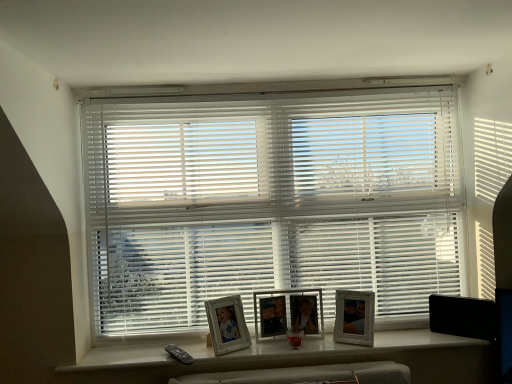
Question: Is white glossy picture frame at center, marked as the third picture frame in a left-to-right arrangement, smaller than white plastic frames at center?

Choices:
 (A) no
 (B) yes

Answer: (B)

Question: Considering the relative sizes of white glossy picture frame at center, arranged as the 1th picture frame when viewed from the right, and white plastic frames at center in the image provided, is white glossy picture frame at center, arranged as the 1th picture frame when viewed from the right, shorter than white plastic frames at center?

Choices:
 (A) yes
 (B) no

Answer: (B)

Question: From a real-world perspective, does white glossy picture frame at center, marked as the third picture frame in a left-to-right arrangement, stand above white plastic frames at center?

Choices:
 (A) yes
 (B) no

Answer: (A)

Question: Is white glossy picture frame at center, arranged as the 1th picture frame when viewed from the right, facing towards white plastic frames at center?

Choices:
 (A) yes
 (B) no

Answer: (B)

Question: Can you confirm if white glossy picture frame at center, arranged as the 1th picture frame when viewed from the right, is positioned to the right of white plastic frames at center?

Choices:
 (A) no
 (B) yes

Answer: (B)

Question: In terms of width, does wooden photo frame at center, arranged as the second picture frame when viewed from the left, look wider or thinner when compared to white plastic blinds at center?

Choices:
 (A) wide
 (B) thin

Answer: (B)

Question: Looking at the image, does wooden photo frame at center, placed as the second picture frame when sorted from right to left, seem bigger or smaller compared to white plastic blinds at center?

Choices:
 (A) big
 (B) small

Answer: (B)

Question: Is point (317, 337) closer or farther from the camera than point (256, 150)?

Choices:
 (A) closer
 (B) farther

Answer: (A)

Question: From the image's perspective, is wooden photo frame at center, placed as the second picture frame when sorted from right to left, located above or below white plastic blinds at center?

Choices:
 (A) below
 (B) above

Answer: (A)

Question: Considering their positions, is white wooden picture frame at center, which is the first picture frame in left-to-right order, located in front of or behind white glossy picture frame at center, arranged as the 1th picture frame when viewed from the right?

Choices:
 (A) front
 (B) behind

Answer: (A)

Question: Looking at the image, does white wooden picture frame at center, the 3th picture frame in the right-to-left sequence, seem bigger or smaller compared to white glossy picture frame at center, marked as the third picture frame in a left-to-right arrangement?

Choices:
 (A) small
 (B) big

Answer: (B)

Question: Would you say white wooden picture frame at center, the 3th picture frame in the right-to-left sequence, is to the left or to the right of white glossy picture frame at center, arranged as the 1th picture frame when viewed from the right, in the picture?

Choices:
 (A) left
 (B) right

Answer: (A)

Question: Is white wooden picture frame at center, which is the first picture frame in left-to-right order, taller or shorter than white glossy picture frame at center, marked as the third picture frame in a left-to-right arrangement?

Choices:
 (A) tall
 (B) short

Answer: (A)

Question: In the image, is white plastic blinds at center positioned in front of or behind wooden photo frame at center, placed as the second picture frame when sorted from right to left?

Choices:
 (A) behind
 (B) front

Answer: (B)

Question: Based on their sizes in the image, would you say white plastic blinds at center is bigger or smaller than wooden photo frame at center, arranged as the second picture frame when viewed from the left?

Choices:
 (A) small
 (B) big

Answer: (B)